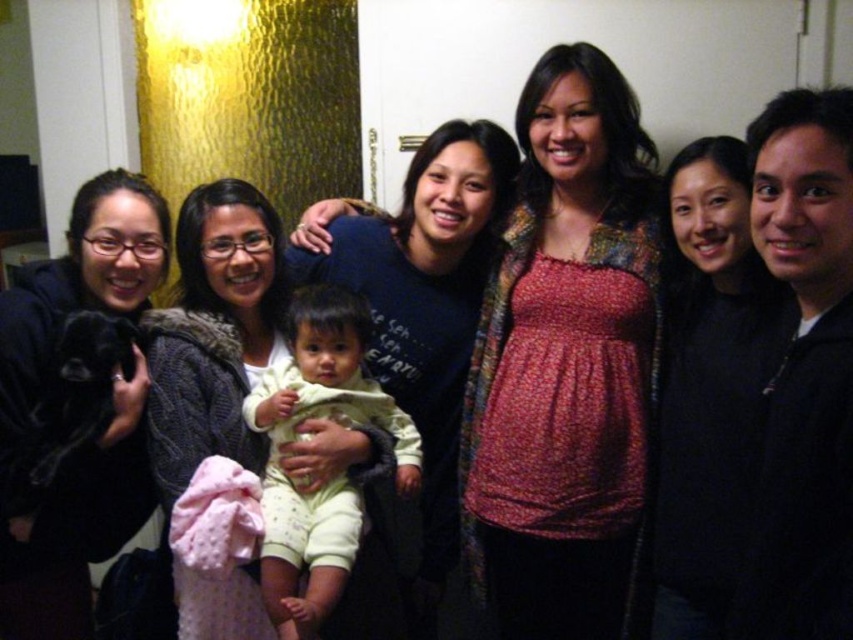
Based on the photo, you are standing in the room and want to touch the point at coordinates (805, 369). Which object must you reach towards to do so?

The point at coordinates (805, 369) is located on the black zip up jacket at right, so you must reach towards the black zip up jacket at right to touch it.